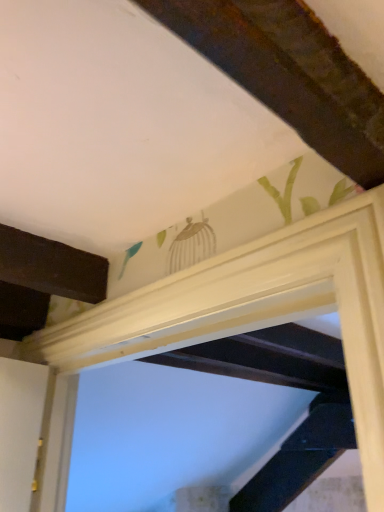
What do you see at coordinates (259, 310) in the screenshot? I see `white wood frame at upper center` at bounding box center [259, 310].

Identify the location of white wood frame at upper center. The image size is (384, 512). (259, 310).

Where is `white wood frame at upper center`? white wood frame at upper center is located at coordinates (259, 310).